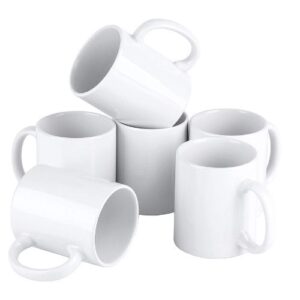
Identify the location of lip of mug. This screenshot has height=300, width=300. tap(95, 230), tap(81, 139), tap(100, 82), tap(134, 129), tap(238, 136), tap(212, 167).